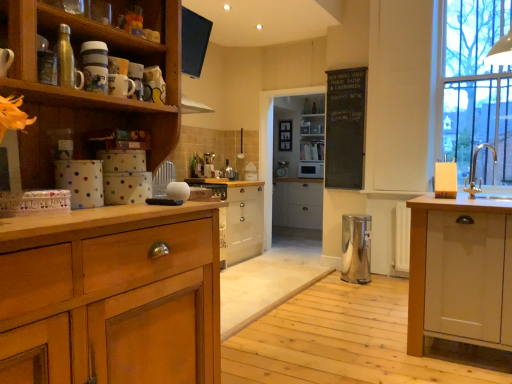
This screenshot has height=384, width=512. I want to click on vacant area that is in front of polished stainless steel trash can at center, which ranks as the 1th appliance in right-to-left order, so click(353, 290).